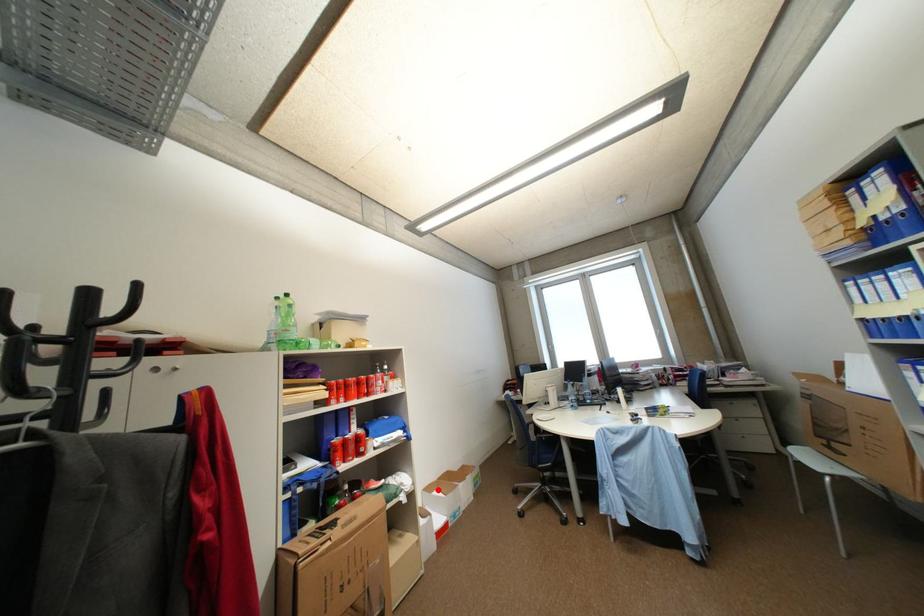
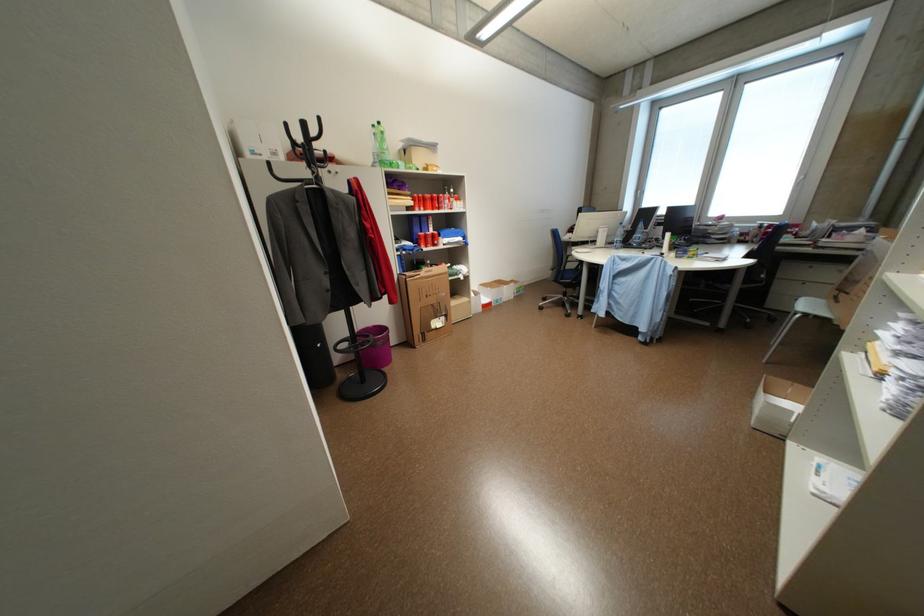
In the second image, find the point that corresponds to the highlighted location in the first image.

(492, 286)